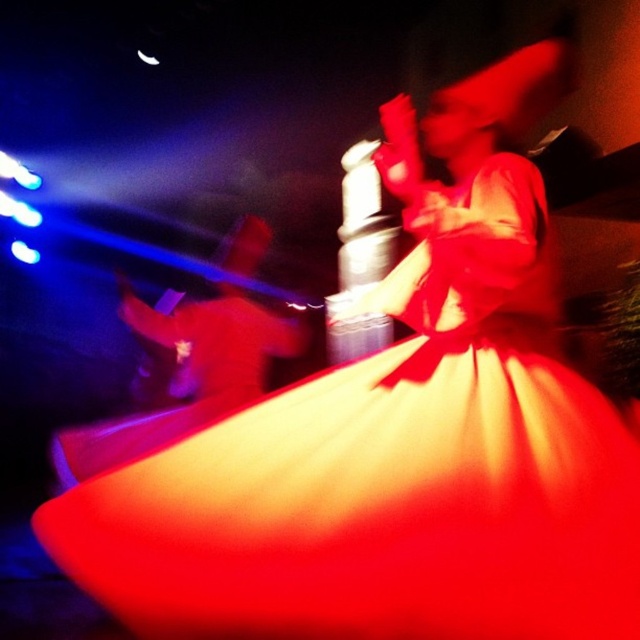
Is point (461, 604) behind point (228, 388)?

That is False.

At what (x,y) coordinates should I click in order to perform the action: click on shiny red fabric dress at center. Please return your answer as a coordinate pair (x, y). This screenshot has height=640, width=640. Looking at the image, I should click on (394, 467).

Describe the element at coordinates (394, 467) in the screenshot. I see `shiny red fabric dress at center` at that location.

The width and height of the screenshot is (640, 640). I want to click on shiny red fabric dress at center, so click(394, 467).